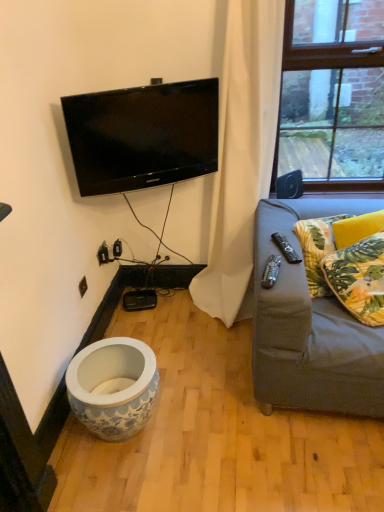
Question: Can you confirm if white fabric curtain at upper right is positioned to the right of green leafy fabric pillow at right, which is the second pillow in back-to-front order?

Choices:
 (A) yes
 (B) no

Answer: (B)

Question: Does white fabric curtain at upper right have a lesser height compared to green leafy fabric pillow at right, which is the second pillow in back-to-front order?

Choices:
 (A) yes
 (B) no

Answer: (B)

Question: Does white fabric curtain at upper right have a greater height compared to green leafy fabric pillow at right, the 1th pillow viewed from the front?

Choices:
 (A) yes
 (B) no

Answer: (A)

Question: From a real-world perspective, is white fabric curtain at upper right under green leafy fabric pillow at right, which is the second pillow in back-to-front order?

Choices:
 (A) yes
 (B) no

Answer: (B)

Question: Does white fabric curtain at upper right have a lesser width compared to green leafy fabric pillow at right, the 1th pillow viewed from the front?

Choices:
 (A) yes
 (B) no

Answer: (B)

Question: From their relative heights in the image, would you say white glossy vase at lower left is taller or shorter than black plastic remote at right?

Choices:
 (A) short
 (B) tall

Answer: (B)

Question: Looking at their shapes, would you say white glossy vase at lower left is wider or thinner than black plastic remote at right?

Choices:
 (A) thin
 (B) wide

Answer: (B)

Question: From the image's perspective, relative to black plastic remote at right, is white glossy vase at lower left above or below?

Choices:
 (A) below
 (B) above

Answer: (A)

Question: Considering the positions of white glossy vase at lower left and black plastic remote at right in the image, is white glossy vase at lower left bigger or smaller than black plastic remote at right?

Choices:
 (A) big
 (B) small

Answer: (A)

Question: Is point (256, 37) closer or farther from the camera than point (286, 243)?

Choices:
 (A) closer
 (B) farther

Answer: (B)

Question: Is white fabric curtain at upper right inside the boundaries of black plastic remote at right, or outside?

Choices:
 (A) outside
 (B) inside

Answer: (A)

Question: Considering the positions of white fabric curtain at upper right and black plastic remote at right in the image, is white fabric curtain at upper right taller or shorter than black plastic remote at right?

Choices:
 (A) tall
 (B) short

Answer: (A)

Question: From the image's perspective, relative to black plastic remote at right, is white fabric curtain at upper right above or below?

Choices:
 (A) below
 (B) above

Answer: (B)

Question: Is yellow floral fabric pillow at right, the second pillow positioned from the front, inside the boundaries of dark gray fabric couch at right, or outside?

Choices:
 (A) inside
 (B) outside

Answer: (A)

Question: Does point (327, 221) appear closer or farther from the camera than point (374, 366)?

Choices:
 (A) farther
 (B) closer

Answer: (A)